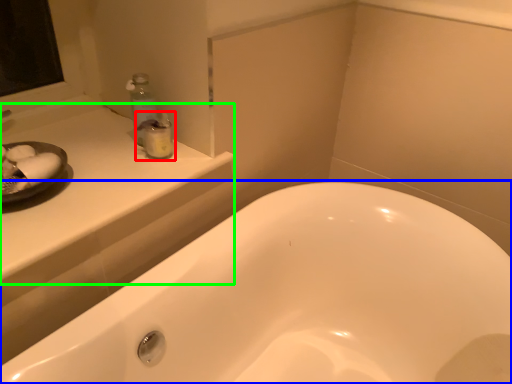
Question: Considering the real-world distances, which object is farthest from toiletry (highlighted by a red box)? bathtub (highlighted by a blue box) or counter top (highlighted by a green box)?

Choices:
 (A) bathtub
 (B) counter top

Answer: (A)